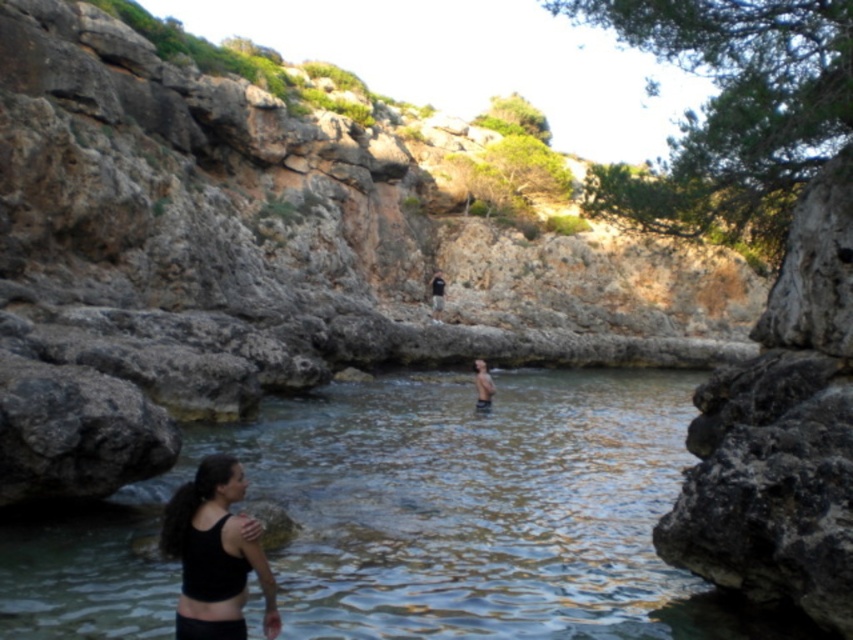
Question: Which point is farther to the camera?

Choices:
 (A) (213, 561)
 (B) (148, 605)
 (C) (483, 396)
 (D) (167, 440)

Answer: (C)

Question: Based on their relative distances, which object is nearer to the black matte tank top at lower left?

Choices:
 (A) clear water at center
 (B) rocky cliff at center

Answer: (A)

Question: Is the position of rocky cliff at center less distant than that of skinny man at center?

Choices:
 (A) no
 (B) yes

Answer: (B)

Question: Does clear water at center have a smaller size compared to black matte tank top at lower left?

Choices:
 (A) no
 (B) yes

Answer: (A)

Question: Observing the image, what is the correct spatial positioning of clear water at center in reference to skinny man at center?

Choices:
 (A) left
 (B) right

Answer: (A)

Question: Which of these objects is positioned closest to the black matte tank top at lower left?

Choices:
 (A) rocky cliff at center
 (B) skinny man at center

Answer: (B)